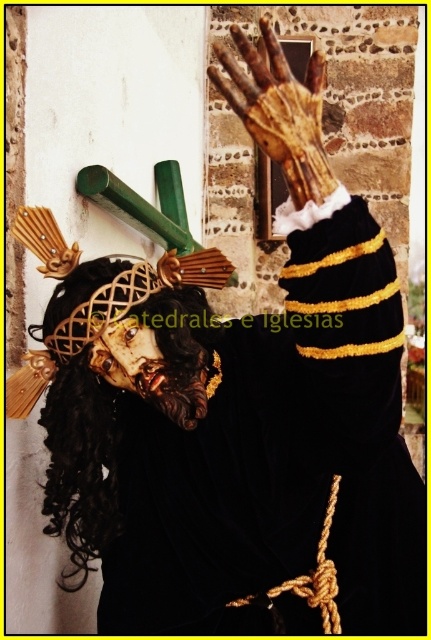
You are an artist trying to sketch the scene. You notice the black curly wig at left and the wooden hand at upper center. Which object should you draw first to ensure proper proportions? Explain your reasoning based on their sizes.

The black curly wig at left is much taller than the wooden hand at upper center, so you should draw the black curly wig at left first to establish its larger size before adding the smaller wooden hand at upper center.

From the picture: You are an art restorer examining a painting. You notice the wooden hand at upper center and the black curly wig at left. Which object is closer to the viewer?

The black curly wig at left is closer to the viewer because the wooden hand at upper center is positioned behind it.

You are an artist trying to sketch this scene. You notice the black curly wig at left and the wooden hand at upper center. Which object is located to the left of the other?

The black curly wig at left is positioned on the left side of wooden hand at upper center.